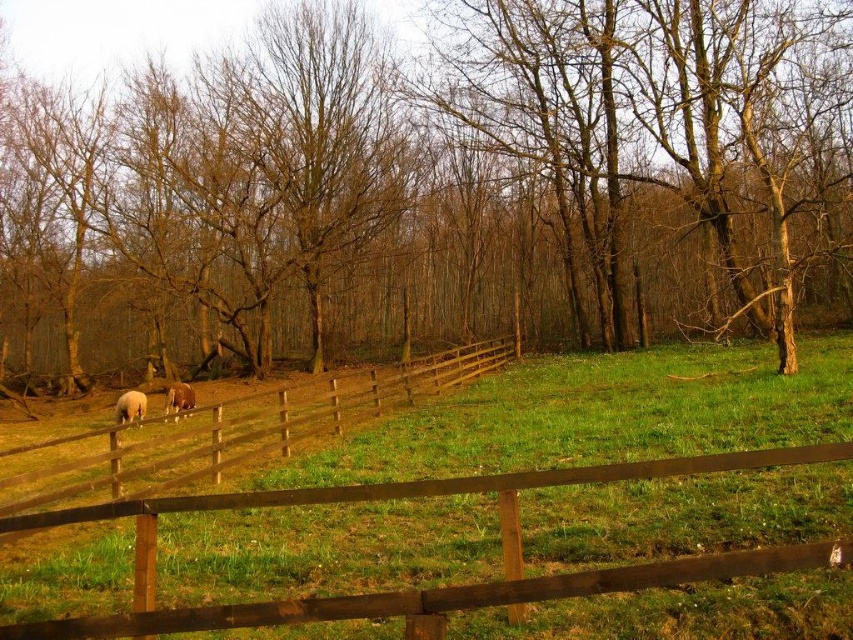
How distant is brown wood fence at lower center from white woolly sheep at lower left?

brown wood fence at lower center is 14.22 meters from white woolly sheep at lower left.

Measure the distance between brown wood fence at lower center and camera.

brown wood fence at lower center and camera are 15.72 meters apart.

Does point (341, 221) lie behind point (120, 422)?

Yes, it is.

In order to click on brown wood fence at lower center in this screenshot , I will do tap(433, 186).

In the scene shown: Between brown wood fence at lower center and white woolly sheep at center, which one appears on the left side from the viewer's perspective?

white woolly sheep at center

Is brown wood fence at lower center shorter than white woolly sheep at center?

Incorrect, brown wood fence at lower center's height does not fall short of white woolly sheep at center's.

Where is `brown wood fence at lower center`? Image resolution: width=853 pixels, height=640 pixels. brown wood fence at lower center is located at coordinates (433, 186).

What are the coordinates of `brown wood fence at lower center` in the screenshot? It's located at (433, 186).

Describe the element at coordinates (230, 433) in the screenshot. The width and height of the screenshot is (853, 640). I see `brown wooden fence at left` at that location.

Can you confirm if brown wooden fence at left is taller than white woolly sheep at lower left?

Yes.

Image resolution: width=853 pixels, height=640 pixels. I want to click on brown wooden fence at left, so tap(230, 433).